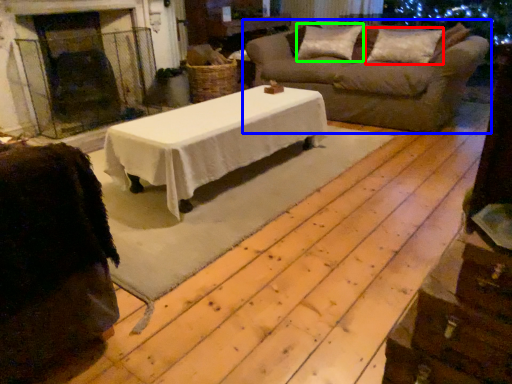
Question: Which is farther away from pillow (highlighted by a red box)? studio sofa (highlighted by a blue box) or pillow (highlighted by a green box)?

Choices:
 (A) studio sofa
 (B) pillow

Answer: (A)